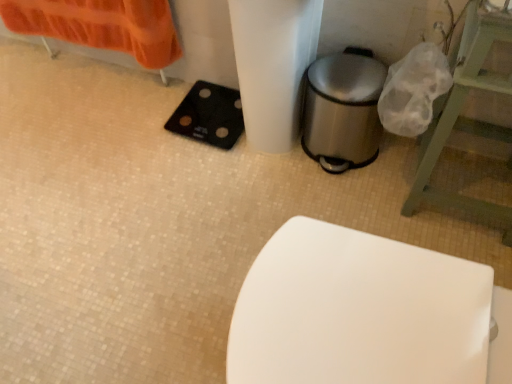
Describe the element at coordinates (209, 115) in the screenshot. I see `black rubber scale at lower left` at that location.

In order to face green wooden stool at right, should I rotate leftwards or rightwards?

Turn right by 30.350 degrees to look at green wooden stool at right.

Describe the element at coordinates (467, 120) in the screenshot. I see `green wooden stool at right` at that location.

Identify the location of black rubber scale at lower left. Image resolution: width=512 pixels, height=384 pixels. (209, 115).

Considering the sizes of objects green wooden stool at right and polished stainless steel trash can at lower right in the image provided, who is thinner, green wooden stool at right or polished stainless steel trash can at lower right?

polished stainless steel trash can at lower right is thinner.

Is green wooden stool at right far away from polished stainless steel trash can at lower right?

They are positioned close to each other.

From the image's perspective, is green wooden stool at right located above or below polished stainless steel trash can at lower right?

From the image's perspective, green wooden stool at right appears below polished stainless steel trash can at lower right.

From a real-world perspective, is black rubber scale at lower left over polished stainless steel trash can at lower right?

No, from a real-world perspective, black rubber scale at lower left is not over polished stainless steel trash can at lower right

Does black rubber scale at lower left come in front of polished stainless steel trash can at lower right?

No, it is not.

Considering the positions of objects black rubber scale at lower left and polished stainless steel trash can at lower right in the image provided, who is more to the right, black rubber scale at lower left or polished stainless steel trash can at lower right?

Positioned to the right is polished stainless steel trash can at lower right.

Is black rubber scale at lower left smaller than polished stainless steel trash can at lower right?

Indeed, black rubber scale at lower left has a smaller size compared to polished stainless steel trash can at lower right.

Measure the distance from polished stainless steel trash can at lower right to black rubber scale at lower left.

A distance of 15.18 inches exists between polished stainless steel trash can at lower right and black rubber scale at lower left.

Consider the image. Is polished stainless steel trash can at lower right bigger or smaller than black rubber scale at lower left?

In the image, polished stainless steel trash can at lower right appears to be larger than black rubber scale at lower left.

Can you confirm if polished stainless steel trash can at lower right is shorter than black rubber scale at lower left?

No, polished stainless steel trash can at lower right is not shorter than black rubber scale at lower left.

Is polished stainless steel trash can at lower right situated inside black rubber scale at lower left or outside?

polished stainless steel trash can at lower right exists outside the volume of black rubber scale at lower left.

Is polished stainless steel trash can at lower right behind green wooden stool at right?

Yes.

Considering the sizes of polished stainless steel trash can at lower right and green wooden stool at right in the image, is polished stainless steel trash can at lower right taller or shorter than green wooden stool at right?

In the image, polished stainless steel trash can at lower right appears to be shorter than green wooden stool at right.

Which is in front, point (312, 88) or point (504, 82)?

The point (504, 82) is more forward.

Can you confirm if polished stainless steel trash can at lower right is positioned to the left of green wooden stool at right?

Correct, you'll find polished stainless steel trash can at lower right to the left of green wooden stool at right.

Is green wooden stool at right oriented towards black rubber scale at lower left?

Yes, green wooden stool at right is facing black rubber scale at lower left.

Considering the sizes of objects green wooden stool at right and black rubber scale at lower left in the image provided, who is shorter, green wooden stool at right or black rubber scale at lower left?

Standing shorter between the two is black rubber scale at lower left.

Is green wooden stool at right in front of black rubber scale at lower left?

That is True.

Based on their positions, is black rubber scale at lower left located to the left or right of green wooden stool at right?

Clearly, black rubber scale at lower left is on the left of green wooden stool at right in the image.

Considering the sizes of black rubber scale at lower left and green wooden stool at right in the image, is black rubber scale at lower left taller or shorter than green wooden stool at right?

Considering their sizes, black rubber scale at lower left has less height than green wooden stool at right.

At what (x,y) coordinates should I click in order to perform the action: click on appliance behind the green wooden stool at right. Please return your answer as a coordinate pair (x, y). The image size is (512, 384). Looking at the image, I should click on (343, 110).

Find the location of a particular element. pad that is on the left side of polished stainless steel trash can at lower right is located at coordinates (209, 115).

Looking at the image, which one is located further to black rubber scale at lower left, polished stainless steel trash can at lower right or green wooden stool at right?

green wooden stool at right.

Looking at the image, which one is located closer to polished stainless steel trash can at lower right, black rubber scale at lower left or green wooden stool at right?

The object closer to polished stainless steel trash can at lower right is green wooden stool at right.

Considering their positions, is green wooden stool at right positioned further to black rubber scale at lower left than polished stainless steel trash can at lower right?

green wooden stool at right lies further to black rubber scale at lower left than the other object.

Which object lies further to the anchor point green wooden stool at right, black rubber scale at lower left or polished stainless steel trash can at lower right?

black rubber scale at lower left lies further to green wooden stool at right than the other object.

When comparing their distances from green wooden stool at right, does polished stainless steel trash can at lower right or black rubber scale at lower left seem further?

black rubber scale at lower left.

Looking at the image, which one is located closer to polished stainless steel trash can at lower right, green wooden stool at right or black rubber scale at lower left?

green wooden stool at right.

Locate an element on the screen. appliance located between green wooden stool at right and black rubber scale at lower left in the depth direction is located at coordinates (343, 110).